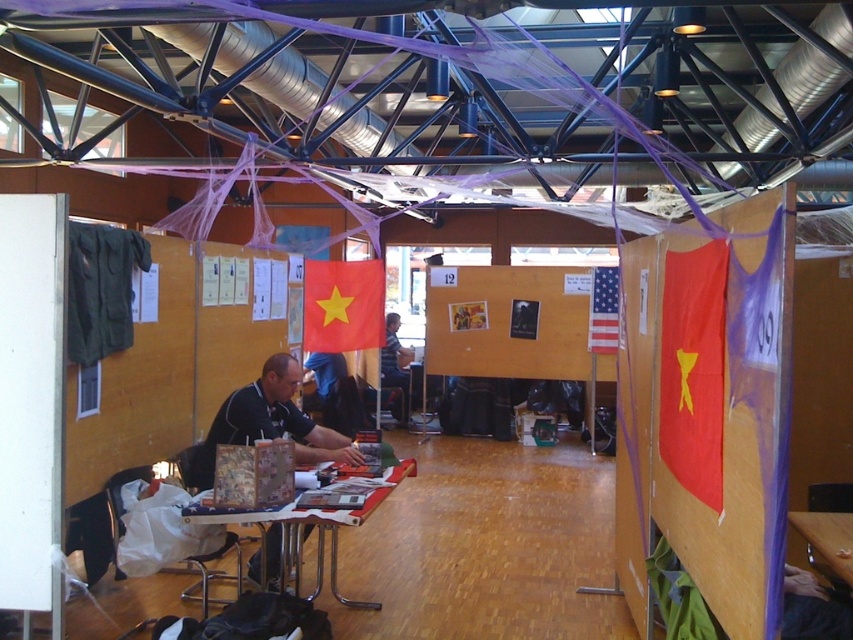
Question: Which object is farther from the camera taking this photo?

Choices:
 (A) red matte flag at right
 (B) matte red flag at center
 (C) wooden table at lower right

Answer: (C)

Question: Which point appears farthest from the camera in this image?

Choices:
 (A) (705, 348)
 (B) (788, 300)
 (C) (360, 476)

Answer: (C)

Question: Is matte red flag at center to the left of red matte flag at right from the viewer's perspective?

Choices:
 (A) yes
 (B) no

Answer: (B)

Question: Can you confirm if black matte shirt at center is bigger than american flag at center?

Choices:
 (A) yes
 (B) no

Answer: (A)

Question: Where is metallic silver table at lower center located in relation to matte black shirt at center in the image?

Choices:
 (A) above
 (B) below

Answer: (B)

Question: Considering the real-world distances, which object is closest to the yellowmatteflag at center?

Choices:
 (A) wooden table at lower right
 (B) metallic silver table at lower center

Answer: (B)